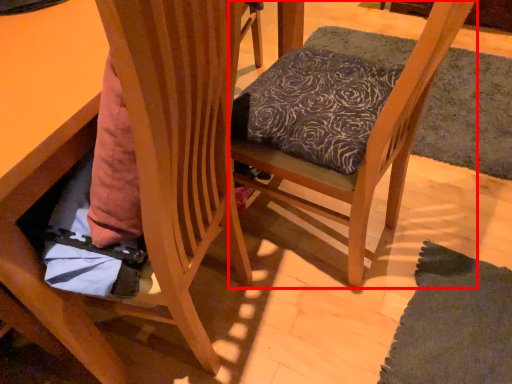
Question: From the image's perspective, what is the correct spatial positioning of chair (annotated by the red box) in reference to chair?

Choices:
 (A) above
 (B) below

Answer: (A)